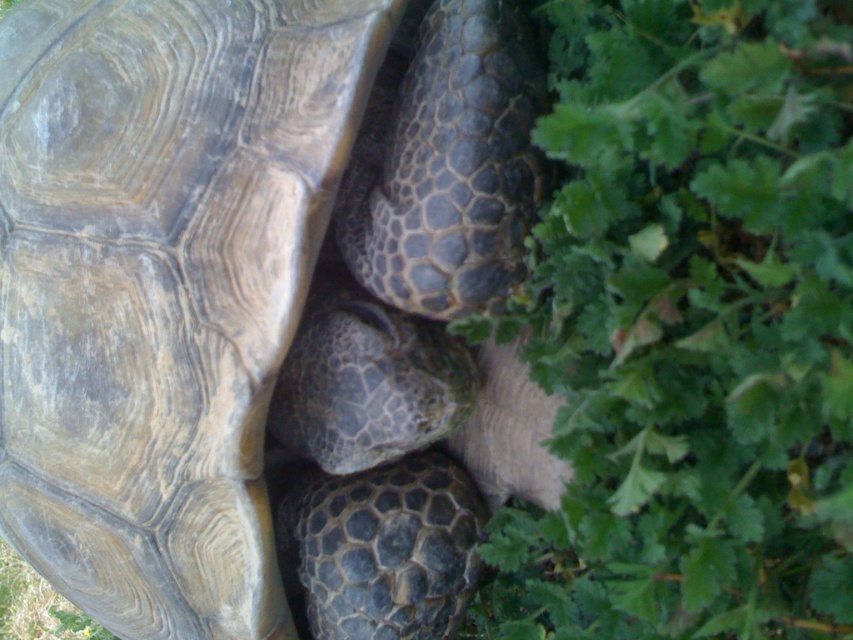
Is leathery brown tortoise at center behind green leafy plant at lower right?

Yes, leathery brown tortoise at center is behind green leafy plant at lower right.

Identify the location of leathery brown tortoise at center. The width and height of the screenshot is (853, 640). click(263, 307).